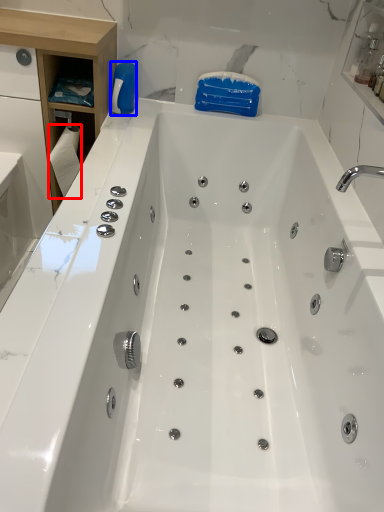
Question: Among these objects, which one is nearest to the camera, toilet paper (highlighted by a red box) or cleaning product (highlighted by a blue box)?

Choices:
 (A) toilet paper
 (B) cleaning product

Answer: (A)